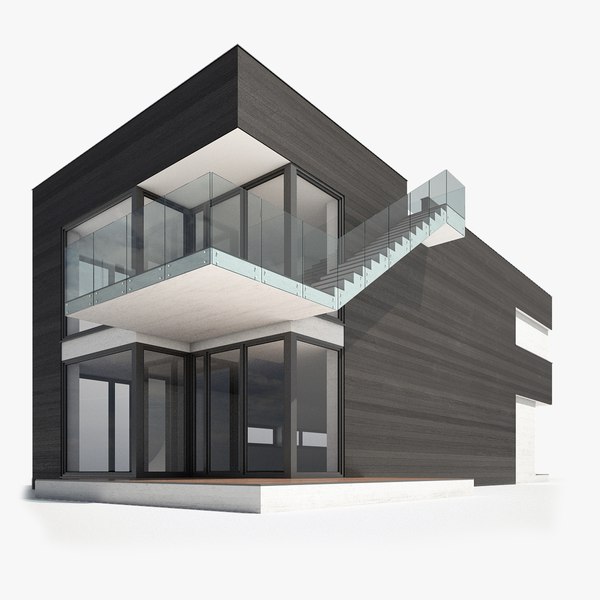
Where is `stairs`? The image size is (600, 600). stairs is located at coordinates (383, 244), (347, 277), (416, 215).